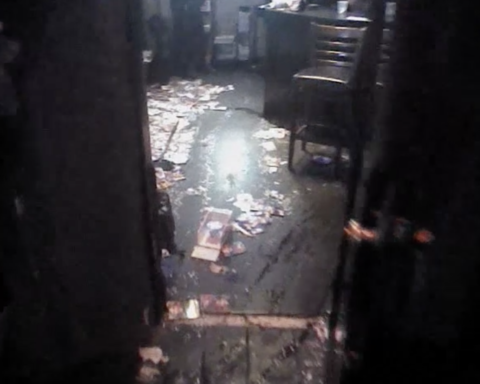
Find the location of a particular element. This screenshot has height=384, width=480. chair is located at coordinates (331, 67).